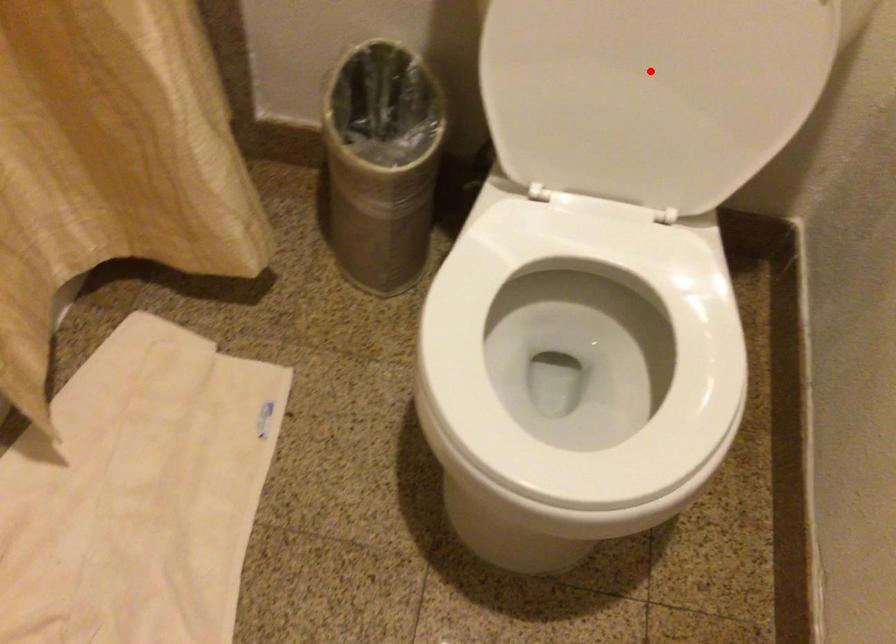
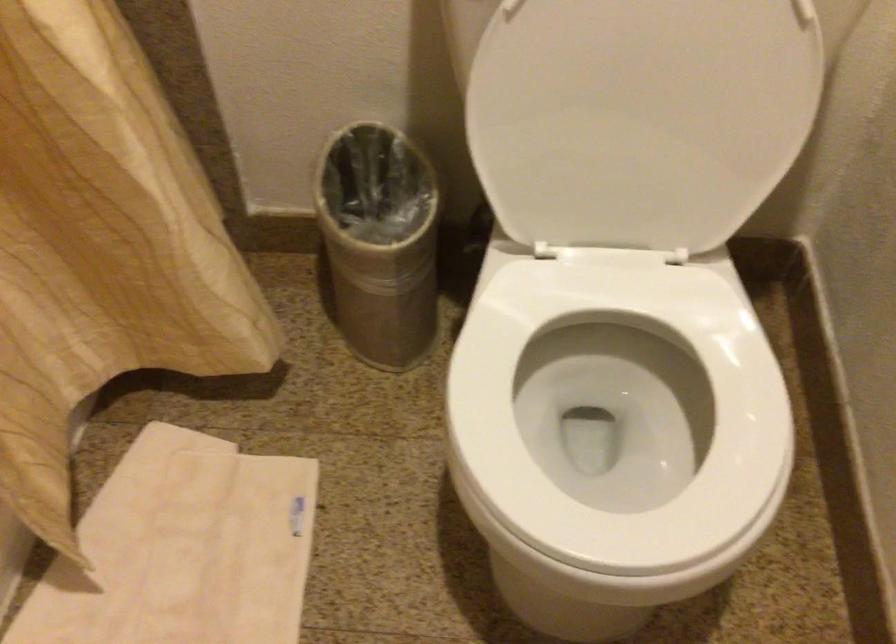
Where in the second image is the point corresponding to the highlighted location from the first image?

(640, 118)